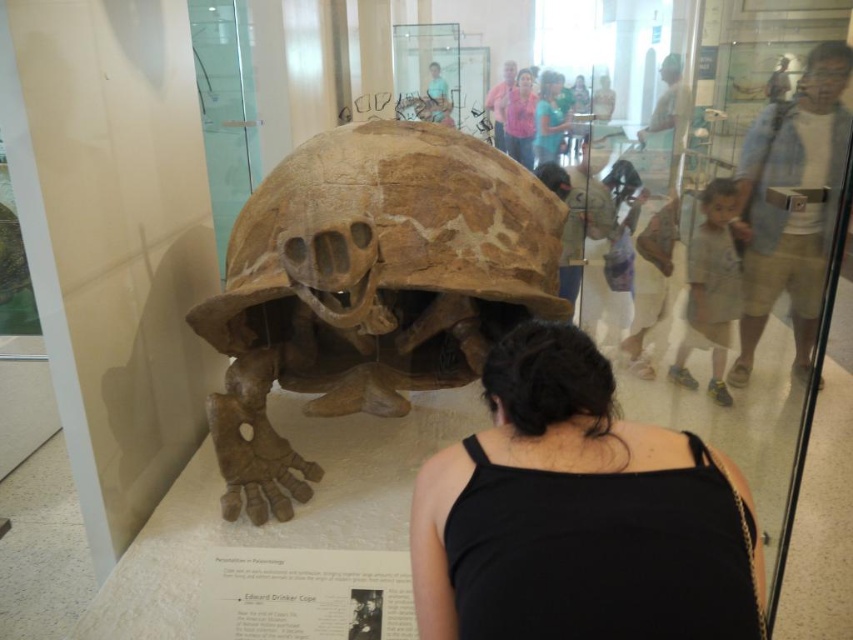
How far apart are brown bone-like at center and black fabric at center?

brown bone-like at center and black fabric at center are 1.88 meters apart.

Which of these two, brown bone-like at center or black fabric at center, stands shorter?

black fabric at center is shorter.

Locate an element on the screen. brown bone-like at center is located at coordinates (368, 288).

The height and width of the screenshot is (640, 853). Find the location of `brown bone-like at center`. brown bone-like at center is located at coordinates (368, 288).

Who is higher up, brown bone-like at center or pink fabric shirt at upper center?

pink fabric shirt at upper center

How far apart are brown bone-like at center and pink fabric shirt at upper center?

The distance of brown bone-like at center from pink fabric shirt at upper center is 9.09 feet.

You are a GUI agent. You are given a task and a screenshot of the screen. Output one action in this format:
    pyautogui.click(x=<x>, y=<y>)
    Task: Click on the brown bone-like at center
    This screenshot has height=640, width=853.
    Given the screenshot: What is the action you would take?
    pyautogui.click(x=368, y=288)

Can you confirm if black fabric at center is positioned to the right of pink fabric shirt at upper center?

Incorrect, black fabric at center is not on the right side of pink fabric shirt at upper center.

Which is above, black fabric at center or pink fabric shirt at upper center?

Positioned higher is pink fabric shirt at upper center.

Between point (647, 545) and point (506, 124), which one is positioned behind?

The point (506, 124) is more distant.

This screenshot has height=640, width=853. I want to click on black fabric at center, so click(x=577, y=515).